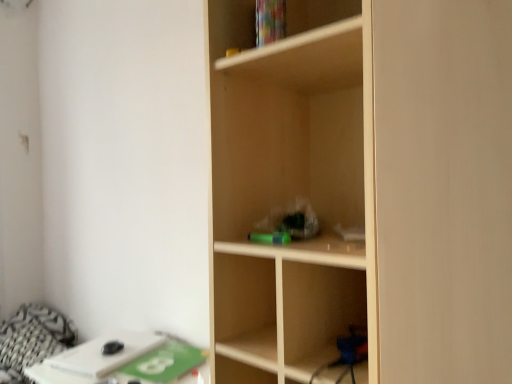
Question: Does light wood shelf at center lie in front of green matte paperback book at lower left?

Choices:
 (A) yes
 (B) no

Answer: (A)

Question: Can you confirm if light wood shelf at center is shorter than green matte paperback book at lower left?

Choices:
 (A) no
 (B) yes

Answer: (A)

Question: Considering the relative sizes of light wood shelf at center and green matte paperback book at lower left in the image provided, is light wood shelf at center smaller than green matte paperback book at lower left?

Choices:
 (A) no
 (B) yes

Answer: (A)

Question: From the image's perspective, is light wood shelf at center beneath green matte paperback book at lower left?

Choices:
 (A) no
 (B) yes

Answer: (A)

Question: Is light wood shelf at center at the left side of green matte paperback book at lower left?

Choices:
 (A) yes
 (B) no

Answer: (B)

Question: Is light wood shelf at center facing towards green matte paperback book at lower left?

Choices:
 (A) no
 (B) yes

Answer: (A)

Question: From the image's perspective, is light wood shelf at center below patterned fabric bedding at lower left?

Choices:
 (A) no
 (B) yes

Answer: (A)

Question: Is light wood shelf at center turned away from patterned fabric bedding at lower left?

Choices:
 (A) no
 (B) yes

Answer: (A)

Question: Is light wood shelf at center wider than patterned fabric bedding at lower left?

Choices:
 (A) yes
 (B) no

Answer: (B)

Question: Is patterned fabric bedding at lower left completely or partially inside light wood shelf at center?

Choices:
 (A) yes
 (B) no

Answer: (B)

Question: Considering the relative sizes of light wood shelf at center and patterned fabric bedding at lower left in the image provided, is light wood shelf at center bigger than patterned fabric bedding at lower left?

Choices:
 (A) no
 (B) yes

Answer: (B)

Question: Is light wood shelf at center located outside patterned fabric bedding at lower left?

Choices:
 (A) no
 (B) yes

Answer: (B)

Question: Does patterned fabric bedding at lower left appear on the left side of white matte table at lower left?

Choices:
 (A) yes
 (B) no

Answer: (A)